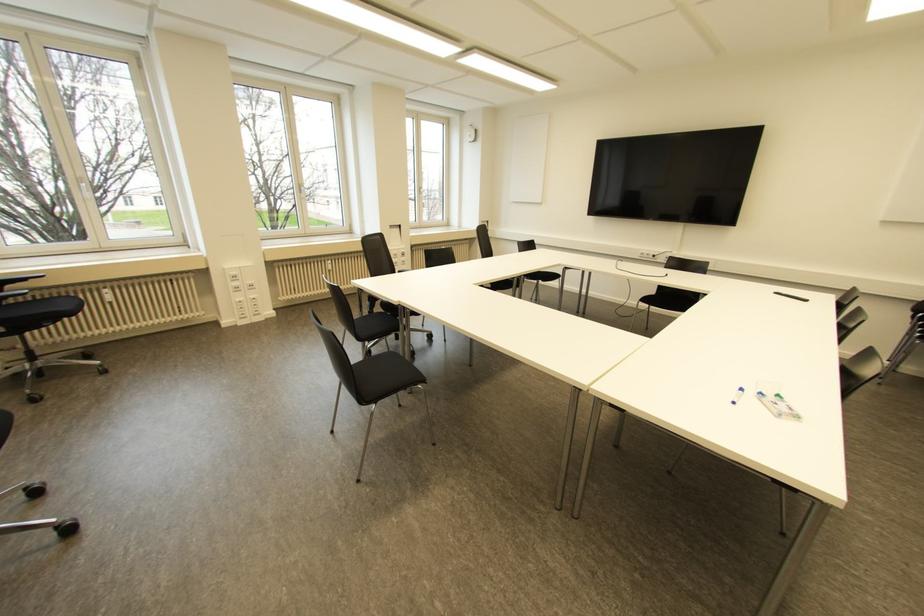
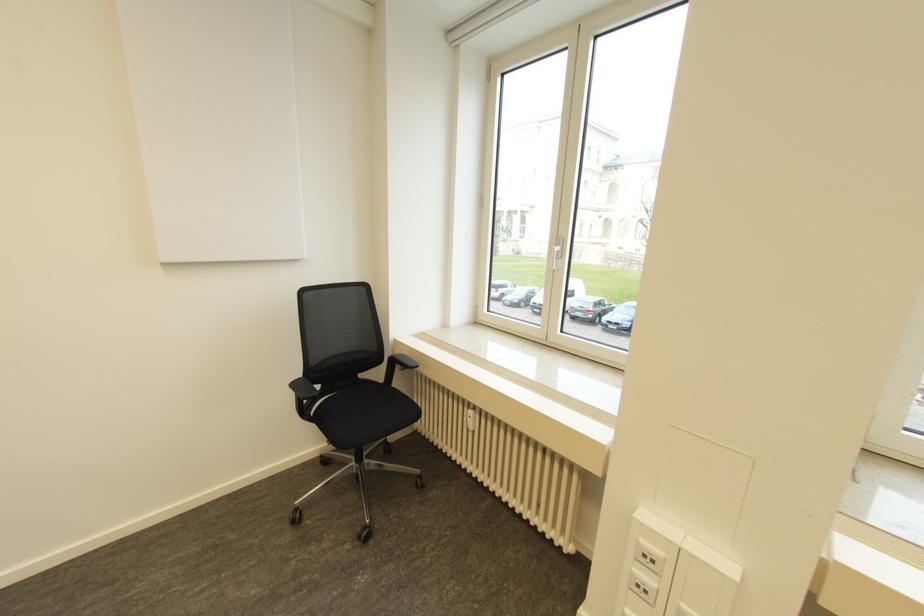
The point at (104, 290) is marked in the first image. Where is the corresponding point in the second image?

(469, 411)